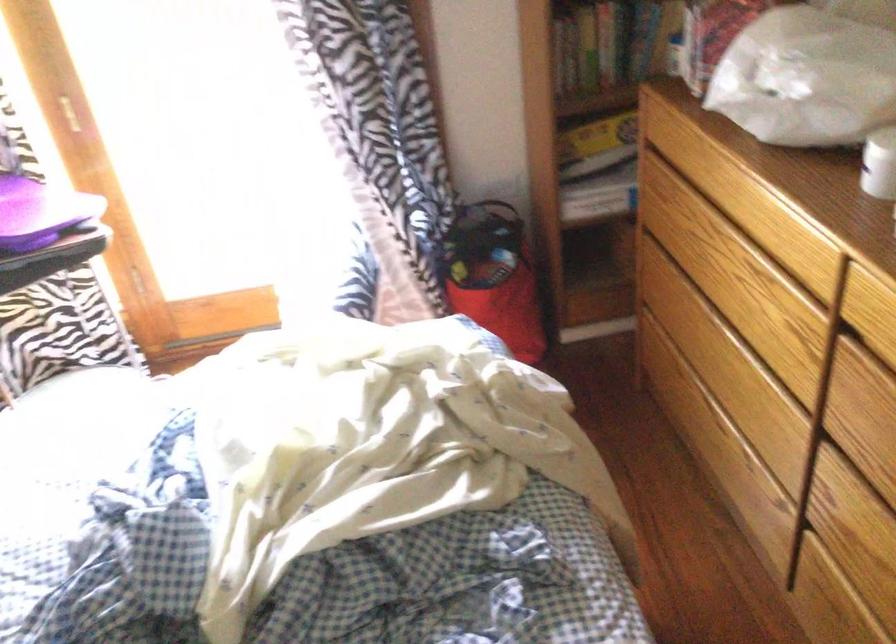
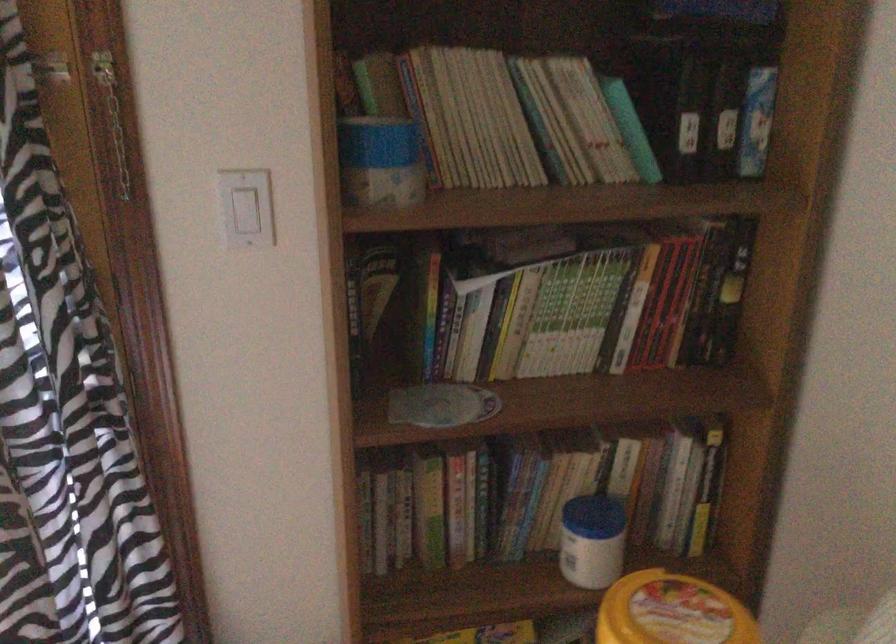
Question: In a continuous first-person perspective shot, in which direction is the camera moving?

Choices:
 (A) Left
 (B) Right
 (C) Forward
 (D) Backward

Answer: (C)